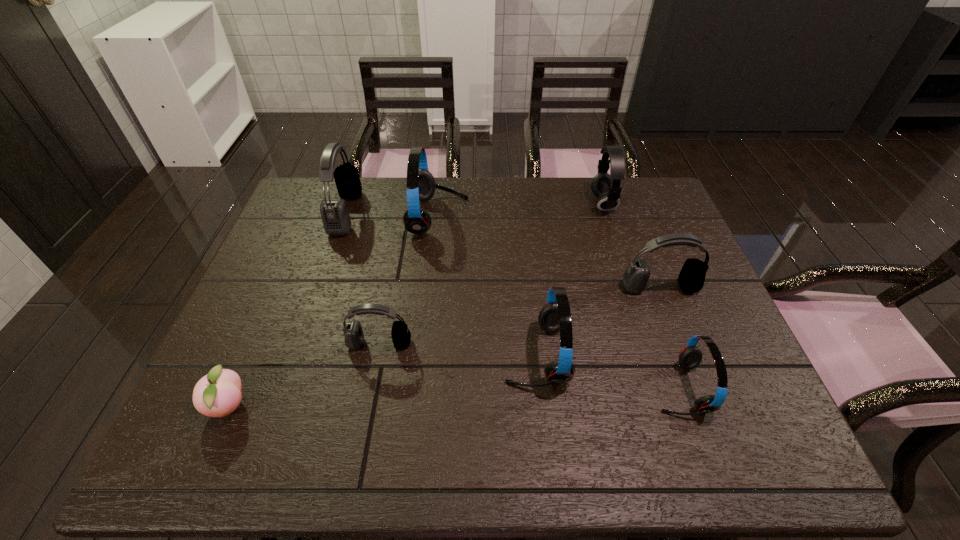
Find the location of a particular element. This screenshot has height=540, width=960. the nearest black headset is located at coordinates tap(354, 336).

Locate an element on the screen. Image resolution: width=960 pixels, height=540 pixels. the smallest red headset is located at coordinates [x=690, y=356].

The image size is (960, 540). Identify the location of pink peach. (217, 394).

At what (x,y) coordinates should I click in order to perform the action: click on peach. Please return your answer as a coordinate pair (x, y). The height and width of the screenshot is (540, 960). Looking at the image, I should click on (217, 394).

Image resolution: width=960 pixels, height=540 pixels. I want to click on free space located 0.050m on the headband of the leftmost black headset, so (x=373, y=213).

Where is `free space located with the microphone attached to the side of the farthest red headset`? free space located with the microphone attached to the side of the farthest red headset is located at coordinates (499, 217).

I want to click on free space located on the ear cups of the earphone, so click(x=503, y=204).

The image size is (960, 540). Identify the location of blank space located 0.250m on the ear cups of the earphone. (515, 204).

Identify the location of vacant point located 0.230m on the ear cups of the earphone. The image size is (960, 540). (521, 204).

The height and width of the screenshot is (540, 960). I want to click on free point located 0.180m on the headband of the second smallest black headset, so click(684, 353).